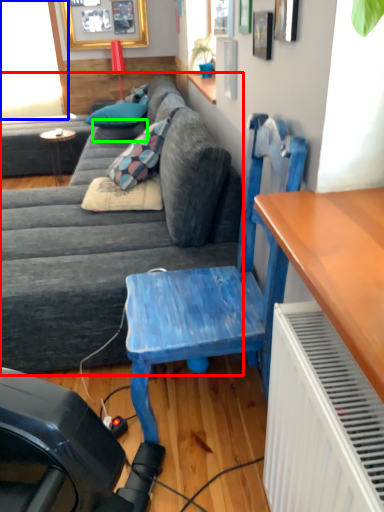
Question: Based on their relative distances, which object is farther from studio couch (highlighted by a red box)? Choose from window screen (highlighted by a blue box) and pillow (highlighted by a green box).

Choices:
 (A) window screen
 (B) pillow

Answer: (A)